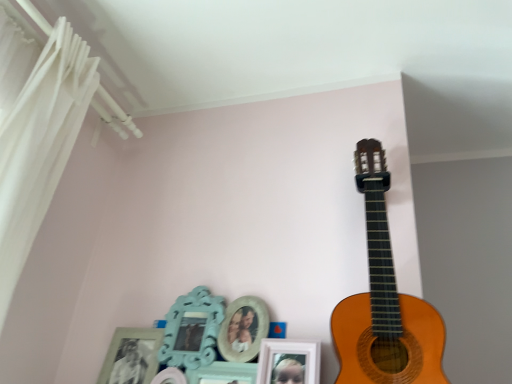
Question: Is white sheer curtain at left outside wooden acoustic guitar at upper right?

Choices:
 (A) yes
 (B) no

Answer: (A)

Question: Would you consider white sheer curtain at left to be distant from wooden acoustic guitar at upper right?

Choices:
 (A) yes
 (B) no

Answer: (B)

Question: Can you confirm if white sheer curtain at left is positioned to the right of wooden acoustic guitar at upper right?

Choices:
 (A) yes
 (B) no

Answer: (B)

Question: Is white sheer curtain at left at the left side of wooden acoustic guitar at upper right?

Choices:
 (A) yes
 (B) no

Answer: (A)

Question: Can you confirm if white sheer curtain at left is taller than wooden acoustic guitar at upper right?

Choices:
 (A) yes
 (B) no

Answer: (A)

Question: Is white sheer curtain at left looking in the opposite direction of wooden acoustic guitar at upper right?

Choices:
 (A) no
 (B) yes

Answer: (A)

Question: From the image's perspective, does wooden acoustic guitar at upper right appear higher than white sheer curtain at left?

Choices:
 (A) yes
 (B) no

Answer: (B)

Question: Considering the relative positions of wooden acoustic guitar at upper right and white sheer curtain at left in the image provided, is wooden acoustic guitar at upper right in front of white sheer curtain at left?

Choices:
 (A) no
 (B) yes

Answer: (A)

Question: From a real-world perspective, is wooden acoustic guitar at upper right located higher than white sheer curtain at left?

Choices:
 (A) yes
 (B) no

Answer: (B)

Question: From the image's perspective, does wooden acoustic guitar at upper right appear lower than white sheer curtain at left?

Choices:
 (A) yes
 (B) no

Answer: (A)

Question: Does wooden acoustic guitar at upper right have a greater height compared to white sheer curtain at left?

Choices:
 (A) no
 (B) yes

Answer: (A)

Question: Considering the relative positions of wooden acoustic guitar at upper right and white sheer curtain at left in the image provided, is wooden acoustic guitar at upper right to the left of white sheer curtain at left from the viewer's perspective?

Choices:
 (A) no
 (B) yes

Answer: (A)

Question: Considering the positions of wooden acoustic guitar at upper right and white sheer curtain at left in the image, is wooden acoustic guitar at upper right wider or thinner than white sheer curtain at left?

Choices:
 (A) thin
 (B) wide

Answer: (A)